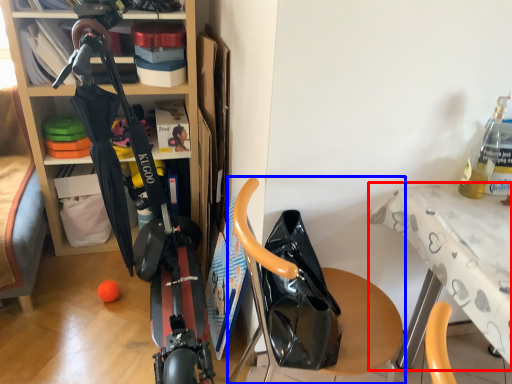
Question: Which of the following is the closest to the observer, table (highlighted by a red box) or furniture (highlighted by a blue box)?

Choices:
 (A) table
 (B) furniture

Answer: (B)